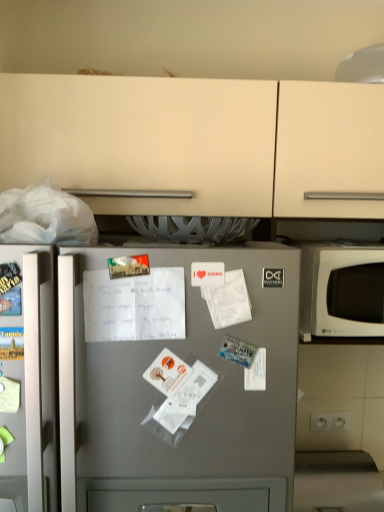
Question: Considering the positions of white paper receipt at center and satin silver fridge at center in the image, is white paper receipt at center taller or shorter than satin silver fridge at center?

Choices:
 (A) short
 (B) tall

Answer: (A)

Question: Considering the positions of white paper receipt at center and satin silver fridge at center in the image, is white paper receipt at center bigger or smaller than satin silver fridge at center?

Choices:
 (A) small
 (B) big

Answer: (A)

Question: Which of these objects is positioned farthest from the white matte microwave at right?

Choices:
 (A) satin silver fridge at center
 (B) white paper receipt at center

Answer: (B)

Question: Which of these objects is positioned farthest from the satin silver fridge at center?

Choices:
 (A) white paper receipt at center
 (B) white matte microwave at right

Answer: (B)